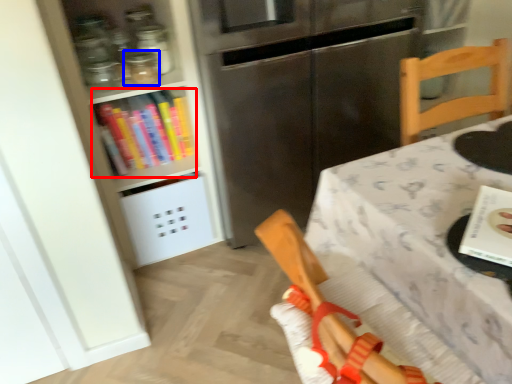
Question: Which object appears closest to the camera in this image, book (highlighted by a red box) or glass jar (highlighted by a blue box)?

Choices:
 (A) book
 (B) glass jar

Answer: (B)